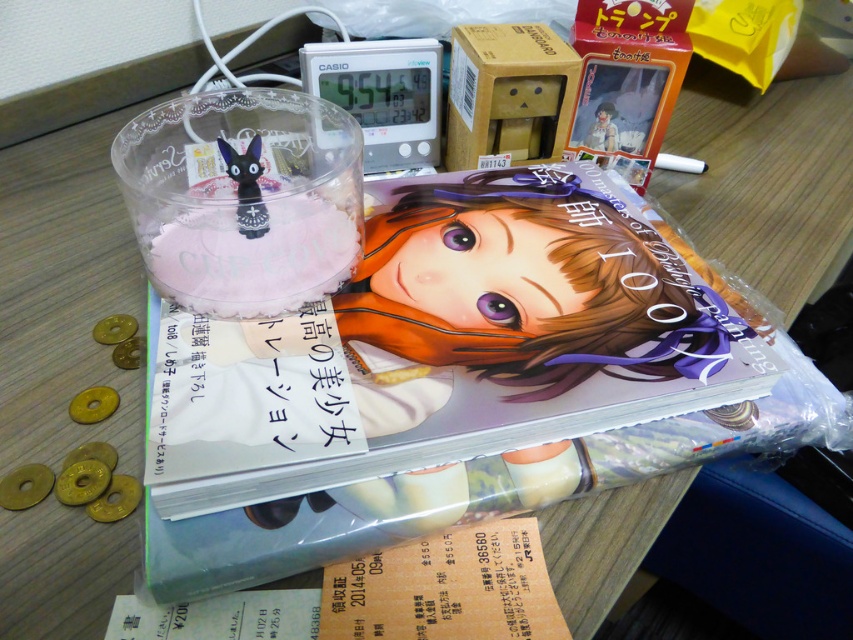
Question: Which object is positioned closest to the matte black cat figurine at upper left?

Choices:
 (A) matte plastic figurine at upper right
 (B) yellow matte coin at lower left

Answer: (B)

Question: Can you confirm if matte black cat figurine at upper left is smaller than yellow matte coin at lower left?

Choices:
 (A) no
 (B) yes

Answer: (A)

Question: Estimate the real-world distances between objects in this image. Which object is closer to the matte black cat figurine at upper left?

Choices:
 (A) yellow matte coin at lower left
 (B) matte plastic figurine at upper right

Answer: (A)

Question: Which point is farther to the camera?

Choices:
 (A) matte black cat figurine at upper left
 (B) matte plastic figurine at upper right
 (C) yellow matte coin at lower left

Answer: (B)

Question: Observing the image, what is the correct spatial positioning of yellow matte coin at lower left in reference to matte plastic figurine at upper right?

Choices:
 (A) left
 (B) right

Answer: (A)

Question: Is matte black cat figurine at upper left smaller than matte plastic figurine at upper right?

Choices:
 (A) yes
 (B) no

Answer: (B)